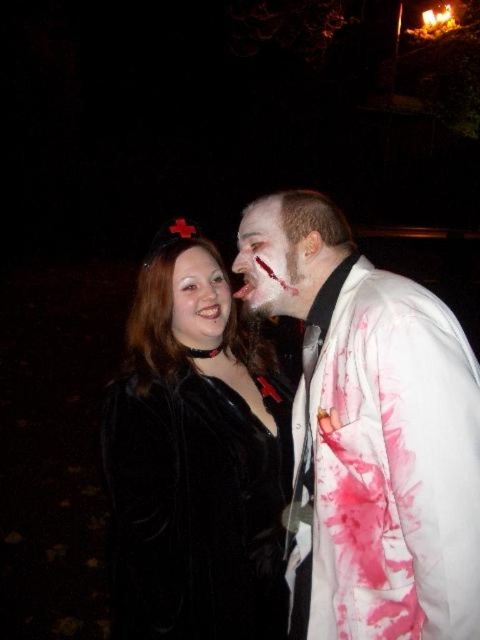
You are a photographer trying to adjust the focus of your camera. You have two points in the image that need to be in focus. The first point is at point (x=388, y=285) and the second is at point (x=188, y=328). Which point should you focus on first to ensure the closest subject is sharp?

You should focus on point (x=388, y=285) first because it is closer to the camera than point (x=188, y=328), ensuring the closest subject is in sharp focus.

You are a costume designer trying to decide which jacket to use for a scene that requires a snug fit. Given the white matte jacket at right and the velvet black coat at center, which one would be more suitable for a character needing a tighter, formfitting costume?

The white matte jacket at right is thinner than the velvet black coat at center, so it would be more suitable for a snug, formfitting costume as it has a slimmer profile.